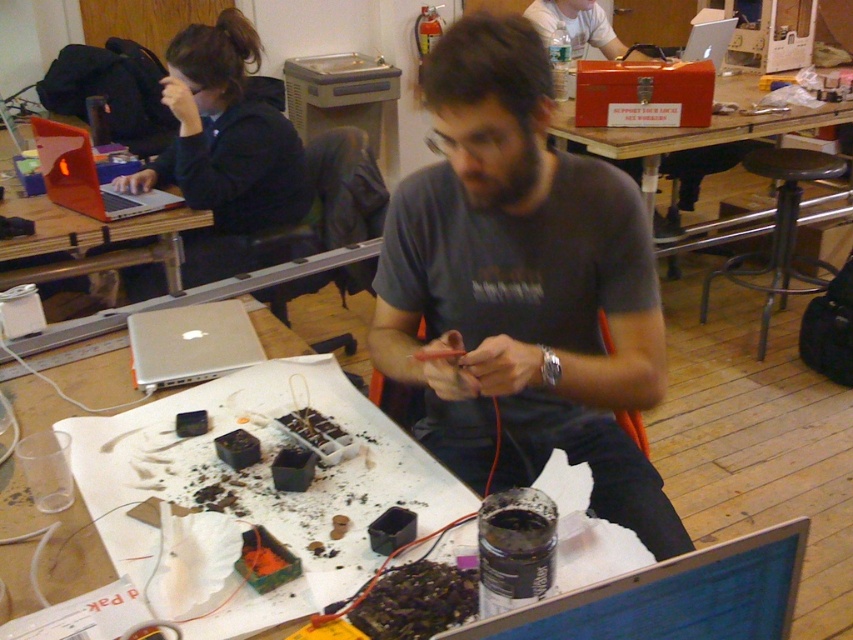
Does metallic silver laptop at upper left have a larger size compared to silver metallic laptop at center?

Yes.

Between metallic silver laptop at upper left and silver metallic laptop at center, which one has more height?

metallic silver laptop at upper left is taller.

Describe the element at coordinates (93, 241) in the screenshot. I see `metallic silver laptop at upper left` at that location.

The width and height of the screenshot is (853, 640). In order to click on metallic silver laptop at upper left in this screenshot , I will do `click(93, 241)`.

Does silver metallic laptop at center have a larger size compared to matte black laptop at left?

Incorrect, silver metallic laptop at center is not larger than matte black laptop at left.

Between point (225, 342) and point (148, 189), which one is positioned behind?

Point (148, 189)

Locate an element on the screen. The height and width of the screenshot is (640, 853). silver metallic laptop at center is located at coordinates (190, 342).

Between matte black laptop at left and silver metallic laptop at upper center, which one is positioned lower?

matte black laptop at left is below.

Is point (173, 202) more distant than point (723, 26)?

No, it is in front of (723, 26).

Between point (149, 209) and point (722, 20), which one is positioned behind?

Positioned behind is point (722, 20).

Where is `matte black laptop at left`? matte black laptop at left is located at coordinates (86, 177).